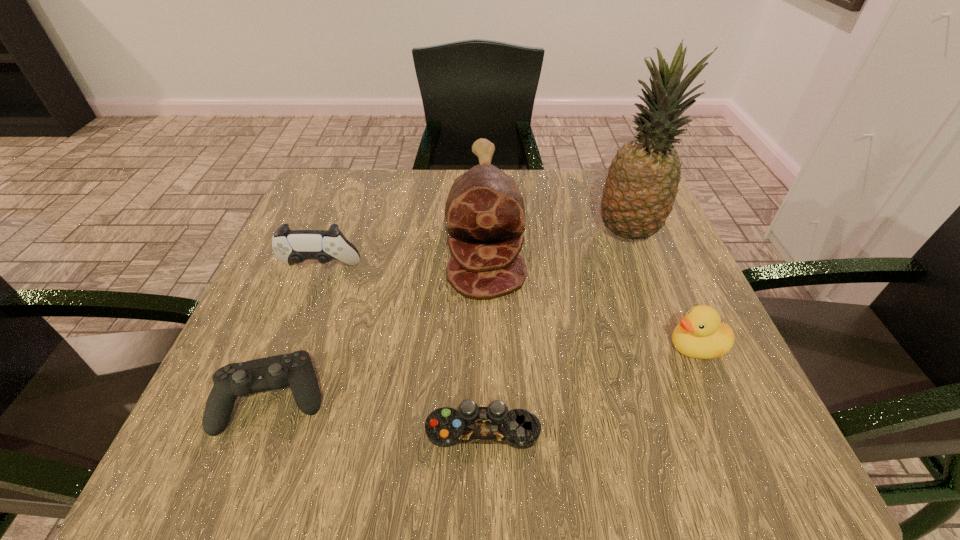
At what (x,y) coordinates should I click in order to perform the action: click on free region located on the face of the duckling. Please return your answer as a coordinate pair (x, y). The image size is (960, 540). Looking at the image, I should click on (437, 347).

Where is `vacant space located 0.350m on the face of the duckling`? vacant space located 0.350m on the face of the duckling is located at coordinates (460, 347).

I want to click on free region located 0.250m on the face of the duckling, so click(x=519, y=347).

Locate an element on the screen. The height and width of the screenshot is (540, 960). vacant space located on the right of the fifth tallest object is located at coordinates (567, 399).

Locate an element on the screen. Image resolution: width=960 pixels, height=540 pixels. blank area located on the right of the rightmost control is located at coordinates (677, 429).

Image resolution: width=960 pixels, height=540 pixels. Identify the location of pineapple that is at the far edge. (642, 184).

Locate an element on the screen. ham positioned at the far edge is located at coordinates (484, 209).

The width and height of the screenshot is (960, 540). What are the coordinates of `pineapple situated at the right edge` in the screenshot? It's located at (642, 184).

You are a GUI agent. You are given a task and a screenshot of the screen. Output one action in this format:
    pyautogui.click(x=<x>, y=<y>)
    Task: Click on the duckling positioned at the right edge
    The width and height of the screenshot is (960, 540).
    Given the screenshot: What is the action you would take?
    pyautogui.click(x=701, y=335)

Where is `object at the near left corner`? object at the near left corner is located at coordinates (295, 370).